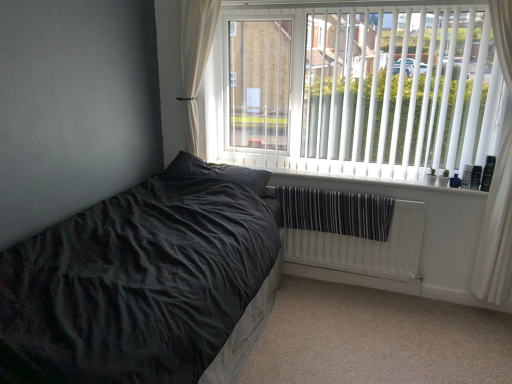
Where is `white vertical blinds at upper right`? white vertical blinds at upper right is located at coordinates (357, 91).

What do you see at coordinates (138, 280) in the screenshot? This screenshot has height=384, width=512. I see `velvet black bed at lower left` at bounding box center [138, 280].

Locate an element on the screen. Image resolution: width=512 pixels, height=384 pixels. white plastic radiator at lower center is located at coordinates (366, 184).

What is the approximate width of white plastic radiator at lower center?

The width of white plastic radiator at lower center is 16.45 centimeters.

Where is `white sheer curtain at right, the 2th curtain positioned from the left`? white sheer curtain at right, the 2th curtain positioned from the left is located at coordinates (496, 233).

Find the location of `the 2nd curtain located above the white plastic radiator at lower center (from a real-world perspective)`. the 2nd curtain located above the white plastic radiator at lower center (from a real-world perspective) is located at coordinates (195, 58).

How many degrees apart are the facing directions of white sheer curtain at upper left, the first curtain positioned from the left, and white plastic radiator at lower center?

The angular difference between white sheer curtain at upper left, the first curtain positioned from the left, and white plastic radiator at lower center is 0.129 degrees.

Is white sheer curtain at upper left, the first curtain positioned from the left, at the left side of white plastic radiator at lower center?

Correct, you'll find white sheer curtain at upper left, the first curtain positioned from the left, to the left of white plastic radiator at lower center.

From a real-world perspective, which is physically above, white vertical blinds at upper right or white sheer curtain at upper left, the first curtain positioned from the left?

white sheer curtain at upper left, the first curtain positioned from the left, is physically above.

Considering the positions of objects white vertical blinds at upper right and white sheer curtain at upper left, the first curtain positioned from the left, in the image provided, who is behind, white vertical blinds at upper right or white sheer curtain at upper left, the first curtain positioned from the left,?

white sheer curtain at upper left, the first curtain positioned from the left, is further away from the camera.

Does white vertical blinds at upper right turn towards white sheer curtain at upper left, the first curtain positioned from the left?

Yes, white vertical blinds at upper right is aimed at white sheer curtain at upper left, the first curtain positioned from the left.

How different are the orientations of white vertical blinds at upper right and white sheer curtain at upper left, the first curtain positioned from the left, in degrees?

0.631 degrees separate the facing orientations of white vertical blinds at upper right and white sheer curtain at upper left, the first curtain positioned from the left.

Is white sheer curtain at upper left, the 2th curtain viewed from the right, aimed at white sheer curtain at right, the 2th curtain positioned from the left?

No, white sheer curtain at upper left, the 2th curtain viewed from the right, is not oriented towards white sheer curtain at right, the 2th curtain positioned from the left.

From the image's perspective, is white sheer curtain at upper left, the 2th curtain viewed from the right, under white sheer curtain at right, the 2th curtain positioned from the left?

No, from the image's perspective, white sheer curtain at upper left, the 2th curtain viewed from the right, is not below white sheer curtain at right, the 2th curtain positioned from the left.

From a real-world perspective, is white sheer curtain at upper left, the 2th curtain viewed from the right, physically located above or below white sheer curtain at right, marked as the first curtain in a right-to-left arrangement?

From a real-world perspective, white sheer curtain at upper left, the 2th curtain viewed from the right, is physically above white sheer curtain at right, marked as the first curtain in a right-to-left arrangement.

Considering the relative sizes of white sheer curtain at upper left, the first curtain positioned from the left, and white sheer curtain at right, the 2th curtain positioned from the left, in the image provided, is white sheer curtain at upper left, the first curtain positioned from the left, bigger than white sheer curtain at right, the 2th curtain positioned from the left,?

Incorrect, white sheer curtain at upper left, the first curtain positioned from the left, is not larger than white sheer curtain at right, the 2th curtain positioned from the left.

Considering the points (410, 43) and (382, 259), which point is in front, point (410, 43) or point (382, 259)?

Point (410, 43)

Is white vertical blinds at upper right with white textured radiator at lower right?

No.

Is white vertical blinds at upper right positioned with its back to white textured radiator at lower right?

No.

Is white sheer curtain at right, the 2th curtain positioned from the left, next to white vertical blinds at upper right?

white sheer curtain at right, the 2th curtain positioned from the left, and white vertical blinds at upper right are clearly separated.

Considering the positions of objects white sheer curtain at right, the 2th curtain positioned from the left, and white vertical blinds at upper right in the image provided, who is behind, white sheer curtain at right, the 2th curtain positioned from the left, or white vertical blinds at upper right?

white vertical blinds at upper right is behind.

Does white sheer curtain at right, the 2th curtain positioned from the left, have a larger size compared to white vertical blinds at upper right?

No, white sheer curtain at right, the 2th curtain positioned from the left, is not bigger than white vertical blinds at upper right.

Looking at this image, is white sheer curtain at right, the 2th curtain positioned from the left, taller than white vertical blinds at upper right?

Yes.

Considering the sizes of objects white textured radiator at lower right and velvet black bed at lower left in the image provided, who is taller, white textured radiator at lower right or velvet black bed at lower left?

velvet black bed at lower left is taller.

Do you think white textured radiator at lower right is within velvet black bed at lower left, or outside of it?

The correct answer is: outside.

Are white textured radiator at lower right and velvet black bed at lower left located far from each other?

No, white textured radiator at lower right is in close proximity to velvet black bed at lower left.

Who is smaller, white textured radiator at lower right or velvet black bed at lower left?

white textured radiator at lower right is smaller.

The width and height of the screenshot is (512, 384). I want to click on window sill on the left of white vertical blinds at upper right, so click(366, 184).

From a real-world perspective, is white vertical blinds at upper right physically located above or below white plastic radiator at lower center?

white vertical blinds at upper right is above white plastic radiator at lower center.

Is white vertical blinds at upper right taller than white plastic radiator at lower center?

Correct, white vertical blinds at upper right is much taller as white plastic radiator at lower center.

Where is `window sill in front of the white sheer curtain at upper left, the 2th curtain viewed from the right`? The image size is (512, 384). window sill in front of the white sheer curtain at upper left, the 2th curtain viewed from the right is located at coordinates (366, 184).

The height and width of the screenshot is (384, 512). Find the location of `window on the right of white sheer curtain at upper left, the 2th curtain viewed from the right`. window on the right of white sheer curtain at upper left, the 2th curtain viewed from the right is located at coordinates (357, 91).

Which object lies nearer to the anchor point white textured radiator at lower right, velvet black bed at lower left or white vertical blinds at upper right?

white vertical blinds at upper right lies closer to white textured radiator at lower right than the other object.

Looking at the image, which one is located closer to white textured radiator at lower right, white vertical blinds at upper right or white sheer curtain at upper left, the 2th curtain viewed from the right?

white vertical blinds at upper right is positioned closer to the anchor white textured radiator at lower right.

When comparing their distances from white vertical blinds at upper right, does white sheer curtain at upper left, the 2th curtain viewed from the right, or white textured radiator at lower right seem further?

Among the two, white sheer curtain at upper left, the 2th curtain viewed from the right, is located further to white vertical blinds at upper right.

When comparing their distances from white plastic radiator at lower center, does white sheer curtain at upper left, the first curtain positioned from the left, or white vertical blinds at upper right seem closer?

Among the two, white vertical blinds at upper right is located nearer to white plastic radiator at lower center.

Estimate the real-world distances between objects in this image. Which object is further from white sheer curtain at right, marked as the first curtain in a right-to-left arrangement, white textured radiator at lower right or white sheer curtain at upper left, the 2th curtain viewed from the right?

Among the two, white sheer curtain at upper left, the 2th curtain viewed from the right, is located further to white sheer curtain at right, marked as the first curtain in a right-to-left arrangement.

Based on their spatial positions, is white vertical blinds at upper right or white textured radiator at lower right further from white plastic radiator at lower center?

white vertical blinds at upper right.

Estimate the real-world distances between objects in this image. Which object is further from velvet black bed at lower left, white vertical blinds at upper right or white textured radiator at lower right?

Among the two, white vertical blinds at upper right is located further to velvet black bed at lower left.

Considering their positions, is white sheer curtain at upper left, the first curtain positioned from the left, positioned closer to velvet black bed at lower left than white sheer curtain at right, the 2th curtain positioned from the left?

white sheer curtain at upper left, the first curtain positioned from the left, is positioned closer to the anchor velvet black bed at lower left.

Where is `curtain between white vertical blinds at upper right and white textured radiator at lower right from top to bottom`? The width and height of the screenshot is (512, 384). curtain between white vertical blinds at upper right and white textured radiator at lower right from top to bottom is located at coordinates (496, 233).

This screenshot has height=384, width=512. What are the coordinates of `window sill between white sheer curtain at upper left, the first curtain positioned from the left, and white vertical blinds at upper right from left to right` in the screenshot? It's located at [x=366, y=184].

Identify the location of curtain situated between velvet black bed at lower left and white sheer curtain at right, the 2th curtain positioned from the left, from left to right. (195, 58).

Where is `window located between velvet black bed at lower left and white plastic radiator at lower center in the depth direction`? The width and height of the screenshot is (512, 384). window located between velvet black bed at lower left and white plastic radiator at lower center in the depth direction is located at coordinates (357, 91).